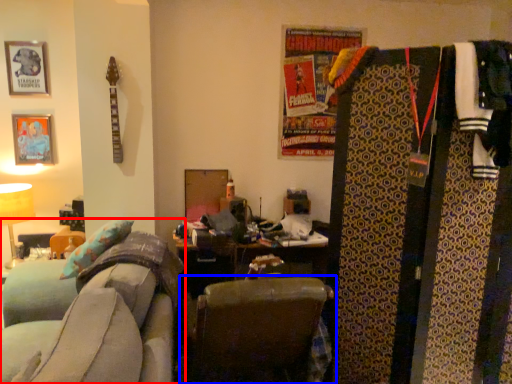
Question: Which object appears closest to the camera in this image, furniture (highlighted by a red box) or chair (highlighted by a blue box)?

Choices:
 (A) furniture
 (B) chair

Answer: (A)